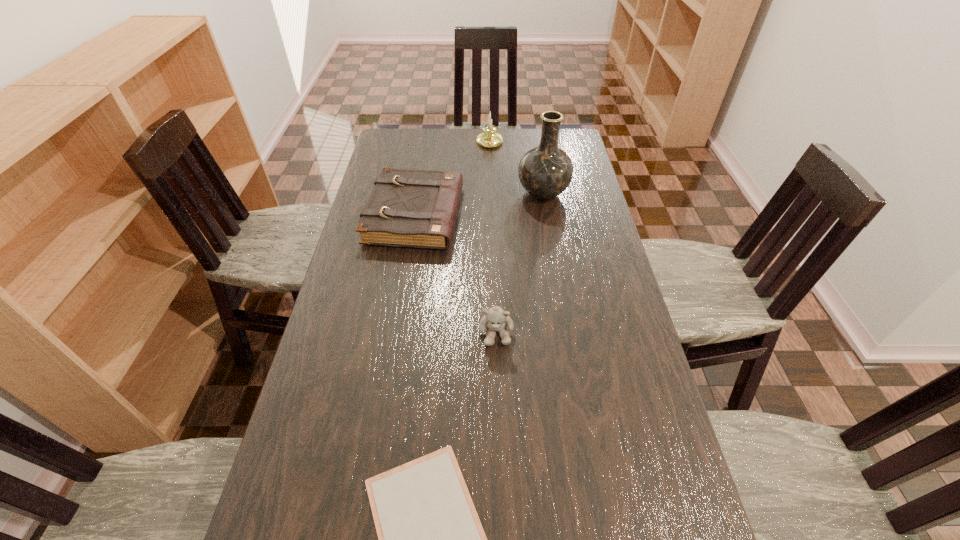
Find the location of a particular element. Image resolution: width=960 pixels, height=540 pixels. blank area located 0.050m on the right of the second shortest object is located at coordinates pyautogui.click(x=476, y=215).

Where is `object located in the far edge section of the desktop`? This screenshot has width=960, height=540. object located in the far edge section of the desktop is located at coordinates (489, 138).

Identify the location of object located at the left edge. (407, 208).

Image resolution: width=960 pixels, height=540 pixels. Identify the location of object at the right edge. (545, 171).

Identify the location of vacant space at the far edge. The image size is (960, 540). (460, 150).

The width and height of the screenshot is (960, 540). In order to click on vacant space at the left edge in this screenshot , I will do `click(365, 262)`.

Image resolution: width=960 pixels, height=540 pixels. In the image, there is a desktop. Identify the location of free region at the right edge. (570, 240).

The width and height of the screenshot is (960, 540). Find the location of `vacant region at the far left corner of the desktop`. vacant region at the far left corner of the desktop is located at coordinates (391, 133).

This screenshot has height=540, width=960. In the image, there is a desktop. What are the coordinates of `vacant space at the far right corner` in the screenshot? It's located at (567, 145).

Where is `free space between the candle holder and the second nearest object`? The width and height of the screenshot is (960, 540). free space between the candle holder and the second nearest object is located at coordinates (492, 238).